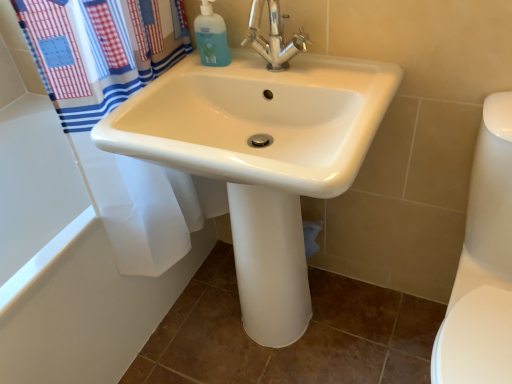
Question: In terms of width, does translucent plastic bottle at upper center look wider or thinner when compared to white glossy bathtub at lower left?

Choices:
 (A) wide
 (B) thin

Answer: (B)

Question: Which is correct: translucent plastic bottle at upper center is inside white glossy bathtub at lower left, or outside of it?

Choices:
 (A) outside
 (B) inside

Answer: (A)

Question: Which of these objects is positioned closest to the white glossy toilet bowl at right?

Choices:
 (A) white glossy bathtub at lower left
 (B) translucent plastic bottle at upper center
 (C) white glossy sink at center
 (D) polished chrome faucet at center

Answer: (C)

Question: Estimate the real-world distances between objects in this image. Which object is farther from the polished chrome faucet at center?

Choices:
 (A) white glossy toilet bowl at right
 (B) white glossy sink at center
 (C) white glossy bathtub at lower left
 (D) translucent plastic bottle at upper center

Answer: (C)